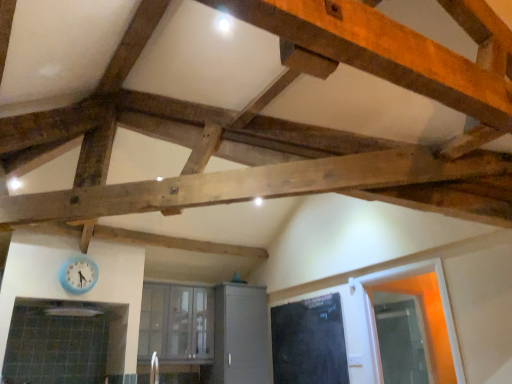
Question: Is black matte door at center touching matte gray cabinet at center?

Choices:
 (A) no
 (B) yes

Answer: (A)

Question: From the image's perspective, is black matte door at center under matte gray cabinet at center?

Choices:
 (A) yes
 (B) no

Answer: (B)

Question: Can you confirm if black matte door at center is positioned to the left of matte gray cabinet at center?

Choices:
 (A) yes
 (B) no

Answer: (B)

Question: Is black matte door at center positioned beyond the bounds of matte gray cabinet at center?

Choices:
 (A) no
 (B) yes

Answer: (B)

Question: Is there a large distance between black matte door at center and matte gray cabinet at center?

Choices:
 (A) no
 (B) yes

Answer: (A)

Question: Considering the relative sizes of black matte door at center and matte gray cabinet at center in the image provided, is black matte door at center shorter than matte gray cabinet at center?

Choices:
 (A) yes
 (B) no

Answer: (A)

Question: Is transparent glass door at right oriented away from matte gray cabinet at center?

Choices:
 (A) no
 (B) yes

Answer: (A)

Question: Could you tell me if transparent glass door at right is turned towards matte gray cabinet at center?

Choices:
 (A) yes
 (B) no

Answer: (B)

Question: Is transparent glass door at right positioned far away from matte gray cabinet at center?

Choices:
 (A) no
 (B) yes

Answer: (B)

Question: Considering the relative sizes of transparent glass door at right and matte gray cabinet at center in the image provided, is transparent glass door at right taller than matte gray cabinet at center?

Choices:
 (A) yes
 (B) no

Answer: (B)

Question: From a real-world perspective, is transparent glass door at right located beneath matte gray cabinet at center?

Choices:
 (A) no
 (B) yes

Answer: (B)

Question: Can you see transparent glass door at right touching matte gray cabinet at center?

Choices:
 (A) no
 (B) yes

Answer: (A)

Question: Is transparent glass door at right taller than clear glass window at center?

Choices:
 (A) no
 (B) yes

Answer: (B)